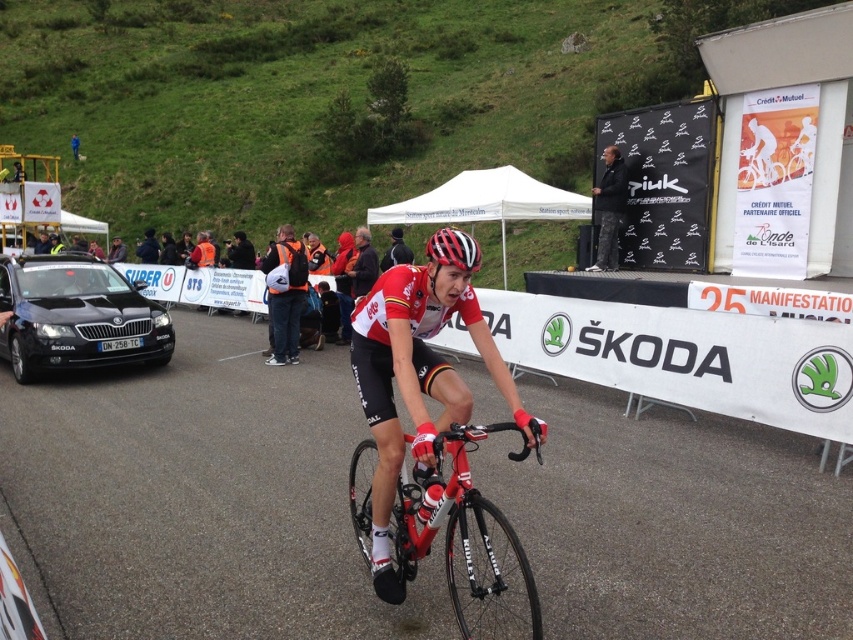
Question: From the image, what is the correct spatial relationship of shiny red bicycle at center in relation to matte black helmet at center?

Choices:
 (A) above
 (B) below

Answer: (B)

Question: Does smooth asphalt road at center have a greater width compared to matte red bicycle at center?

Choices:
 (A) no
 (B) yes

Answer: (A)

Question: Which is farther from the black metallic car at left?

Choices:
 (A) matte black helmet at center
 (B) matte red bicycle at center
 (C) smooth asphalt road at center

Answer: (A)

Question: Is matte red bicycle at center bigger than orange reflective vest at center?

Choices:
 (A) yes
 (B) no

Answer: (A)

Question: Which of the following is the farthest from the observer?

Choices:
 (A) camouflage pants at upper center
 (B) matte black helmet at center

Answer: (A)

Question: Which object appears farthest from the camera in this image?

Choices:
 (A) matte red bicycle at center
 (B) shiny red bicycle at center
 (C) orange reflective vest at center
 (D) smooth asphalt road at center

Answer: (C)